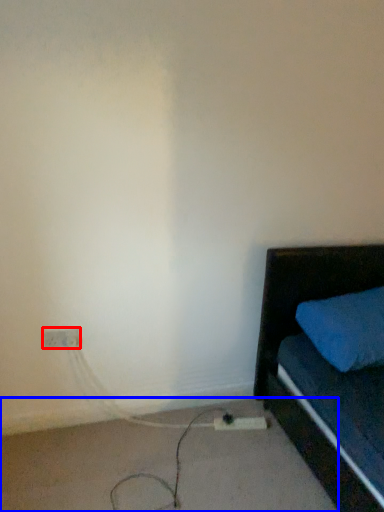
Question: Which object appears closest to the camera in this image, electric outlet (highlighted by a red box) or concrete (highlighted by a blue box)?

Choices:
 (A) electric outlet
 (B) concrete

Answer: (B)